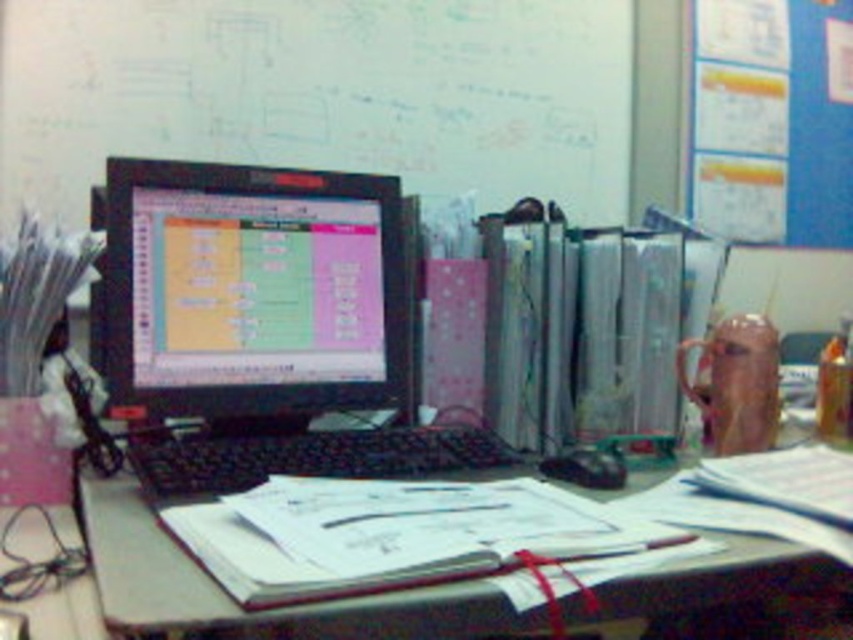
Can you confirm if white paper at center is taller than blue paperboard at upper right?

No, white paper at center is not taller than blue paperboard at upper right.

At what (x,y) coordinates should I click in order to perform the action: click on white paper at center. Please return your answer as a coordinate pair (x, y). Looking at the image, I should click on (236, 604).

Image resolution: width=853 pixels, height=640 pixels. Identify the location of white paper at center. (236, 604).

Does white paper at center have a lesser width compared to black plastic keyboard at center?

No, white paper at center is not thinner than black plastic keyboard at center.

Can you confirm if white paper at center is shorter than black plastic keyboard at center?

Incorrect, white paper at center's height does not fall short of black plastic keyboard at center's.

Who is more forward, (695, 580) or (238, 484)?

Point (695, 580)

Image resolution: width=853 pixels, height=640 pixels. Find the location of `white paper at center`. white paper at center is located at coordinates (236, 604).

Which of these two, blue paperboard at upper right or black plastic keyboard at center, stands taller?

blue paperboard at upper right is taller.

Is blue paperboard at upper right positioned in front of black plastic keyboard at center?

No, it is behind black plastic keyboard at center.

Is point (699, 13) positioned after point (480, 451)?

Yes, point (699, 13) is farther from viewer.

Identify the location of blue paperboard at upper right. (773, 120).